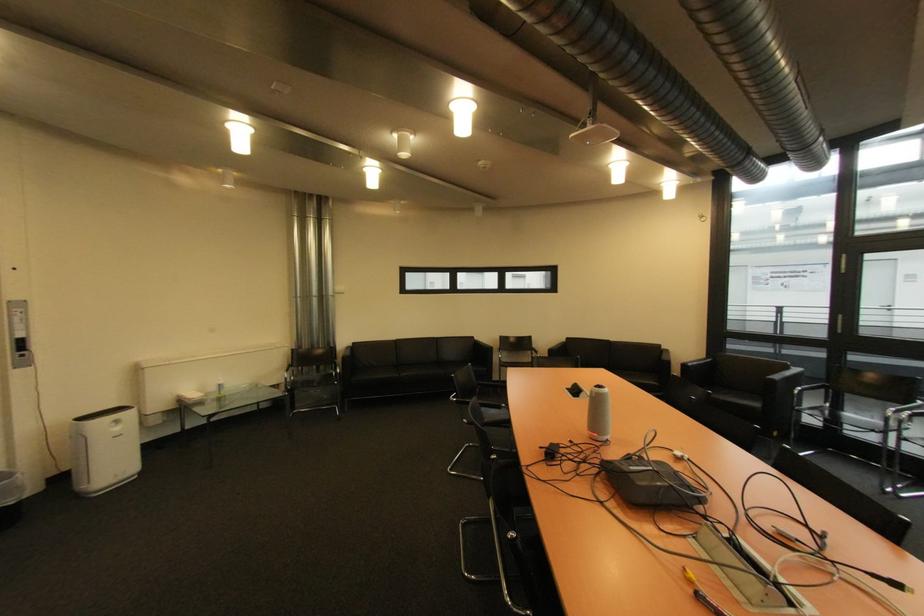
Where is `sofa sitting surface`? The image size is (924, 616). sofa sitting surface is located at coordinates (406, 371).